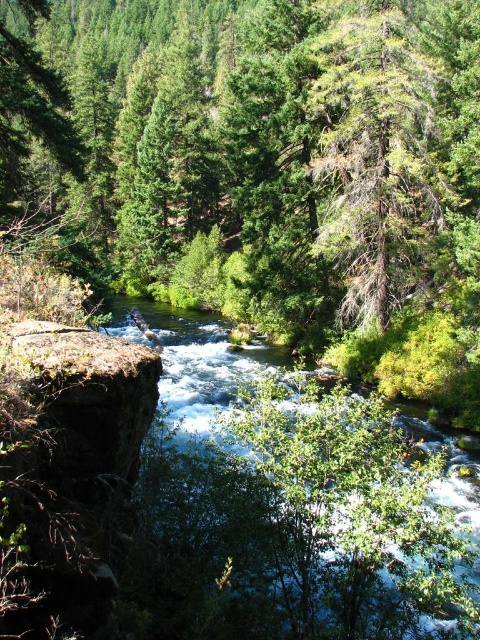
You are a photographer planning to capture the clear water at center and the green textured tree at upper right in a single frame. Based on their sizes in the image, which object would appear more prominent in the final photograph?

The green textured tree at upper right would appear more prominent in the photograph since it is larger than the clear water at center according to the description.

Based on the photo, you are a hiker who wants to cross the river using a fallen log. You see the clear water at center and the green textured tree at upper right. How far apart are these two landmarks?

The clear water at center and the green textured tree at upper right are 9.07 meters apart.

You are an environmental scientist assessing the river health. You see the clear water at center and the green textured tree at upper right. Which object is wider in the image?

The clear water at center is wider than the green textured tree at upper right according to the description.